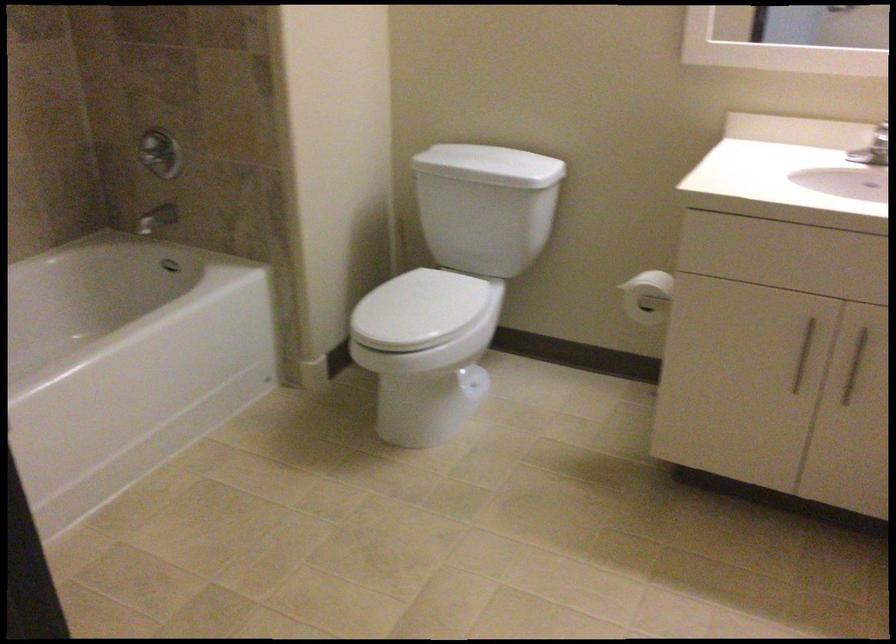
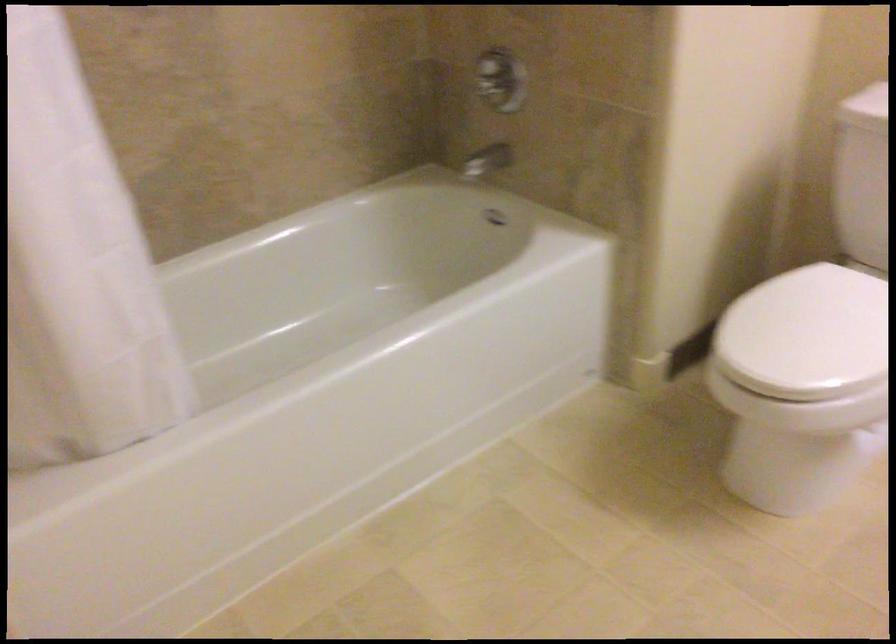
Which direction would the cameraman need to move to produce the second image?

The cameraman walked toward left, forward.